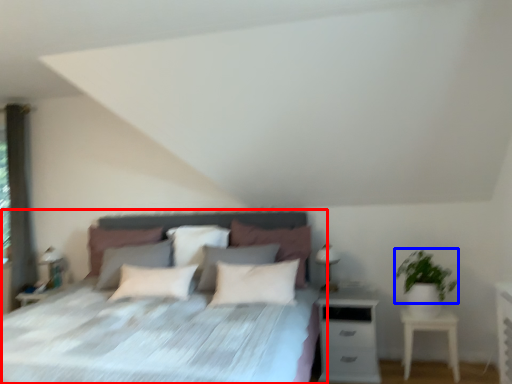
Question: Which object is closer to the camera taking this photo, bed (highlighted by a red box) or plant (highlighted by a blue box)?

Choices:
 (A) bed
 (B) plant

Answer: (A)